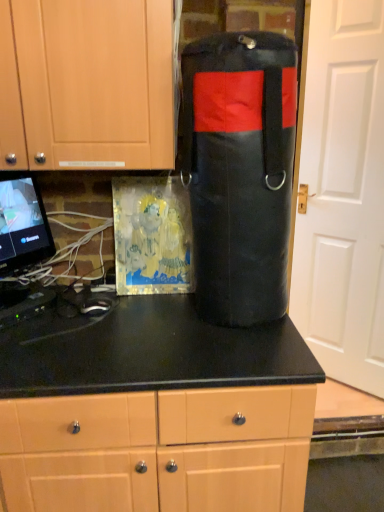
Locate an element on the screen. The image size is (384, 512). vacant area on top of matte black countertop at center, the first cabinetry positioned from the bottom (from a real-world perspective) is located at coordinates click(144, 336).